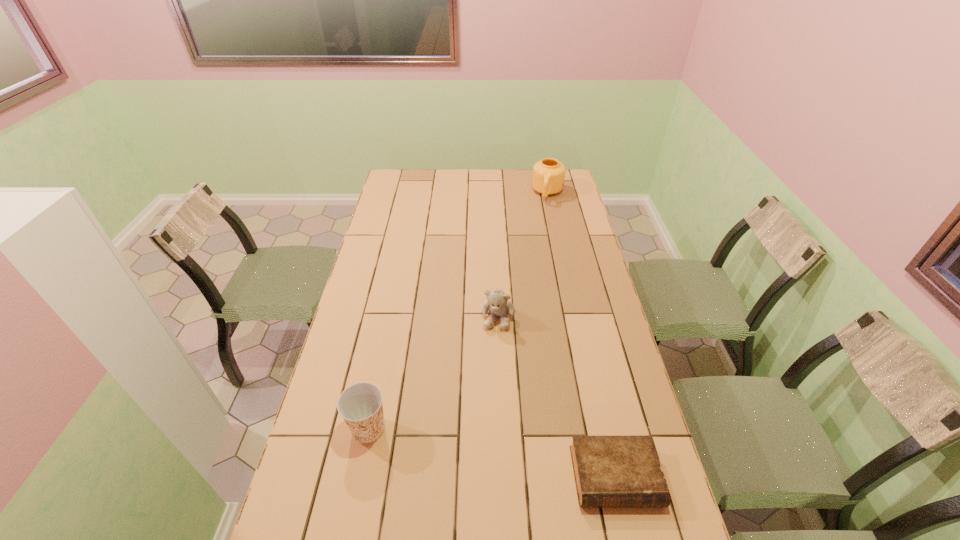
At what (x,y) coordinates should I click in order to perform the action: click on free space on the desktop that is between the leftmost object and the diary and is positioned on the face of the teddy bear. Please return your answer as a coordinate pair (x, y). The width and height of the screenshot is (960, 540). Looking at the image, I should click on (475, 450).

Locate an element on the screen. The height and width of the screenshot is (540, 960). vacant spot on the desktop that is between the leftmost object and the shortest object and is positioned on the handle side of the mug is located at coordinates (489, 452).